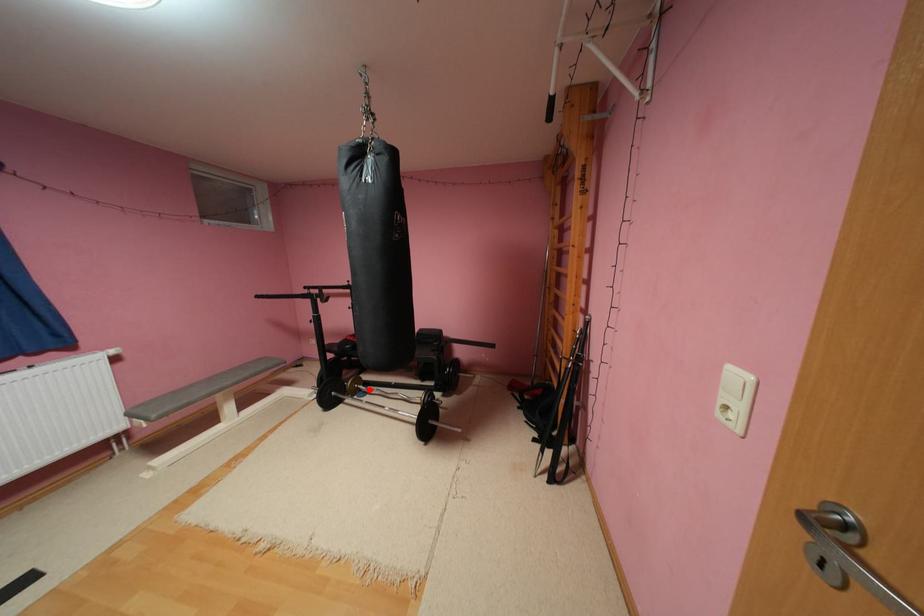
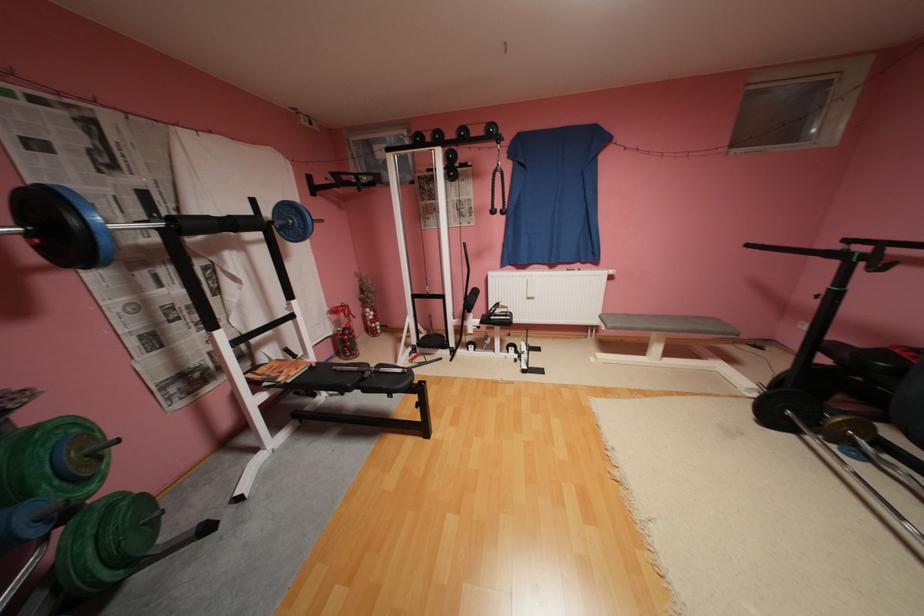
Question: A red point is marked in image1. In image2, is the corresponding 3D point closer to the camera or farther? Reply with the corresponding letter.

Choices:
 (A) The corresponding 3D point is closer.
 (B) The corresponding 3D point is farther.

Answer: (A)